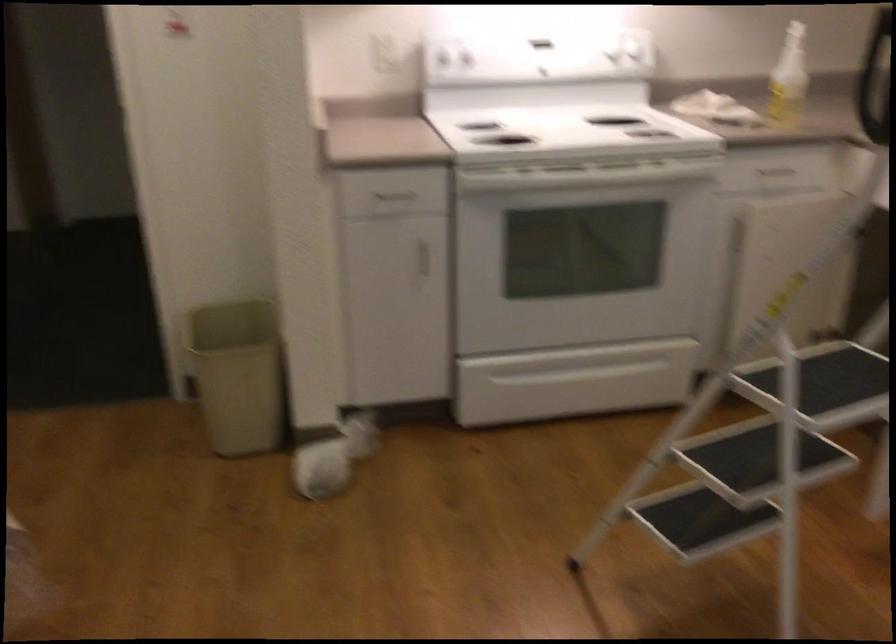
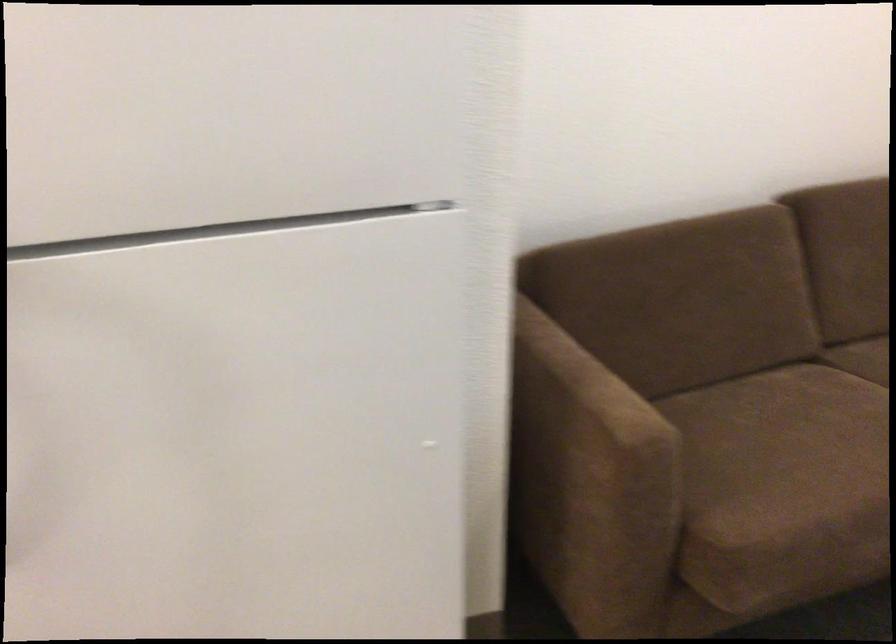
Based on the continuous images, in which direction is the camera rotating?

The camera rotated toward right-down.